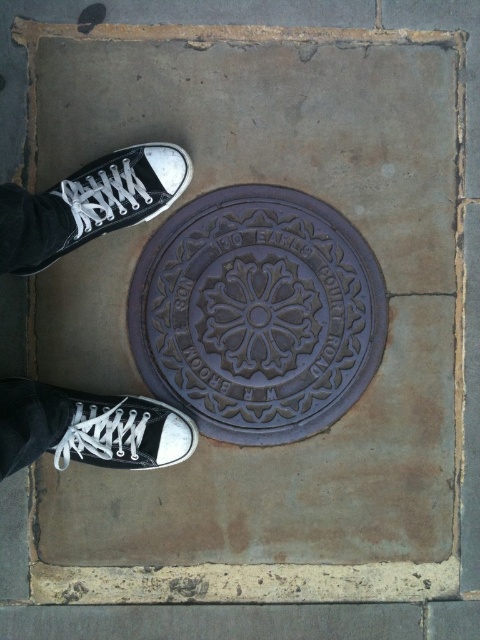
Question: Which point is farther to the camera?

Choices:
 (A) black canvas shoe at center
 (B) purple cast iron manhole at center

Answer: (B)

Question: Can you confirm if purple cast iron manhole at center is smaller than black canvas shoe at center?

Choices:
 (A) no
 (B) yes

Answer: (A)

Question: Which object is positioned closest to the black canvas shoe at center?

Choices:
 (A) black canvas shoe at lower left
 (B) white canvas shoe at lower left
 (C) purple cast iron manhole at center

Answer: (C)

Question: Is purple cast iron manhole at center bigger than white canvas shoe at lower left?

Choices:
 (A) no
 (B) yes

Answer: (B)

Question: Does purple cast iron manhole at center have a larger size compared to black canvas shoe at center?

Choices:
 (A) no
 (B) yes

Answer: (B)

Question: Based on their relative distances, which object is nearer to the white canvas shoe at lower left?

Choices:
 (A) black canvas shoe at lower left
 (B) purple cast iron manhole at center

Answer: (A)